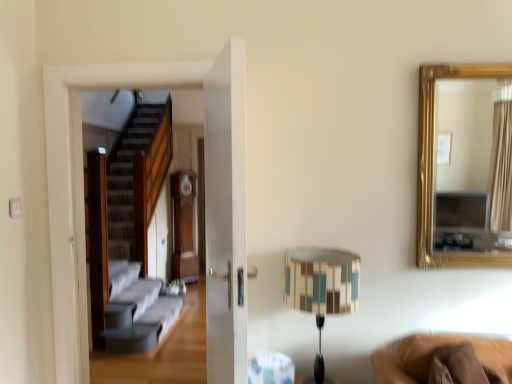
Question: From a real-world perspective, is multicolored fabric lampshade at center on gold-framed mirror at upper right?

Choices:
 (A) no
 (B) yes

Answer: (A)

Question: Is multicolored fabric lampshade at center to the right of gold-framed mirror at upper right from the viewer's perspective?

Choices:
 (A) no
 (B) yes

Answer: (A)

Question: Is multicolored fabric lampshade at center not near gold-framed mirror at upper right?

Choices:
 (A) yes
 (B) no

Answer: (A)

Question: Is the depth of multicolored fabric lampshade at center less than that of gold-framed mirror at upper right?

Choices:
 (A) no
 (B) yes

Answer: (B)

Question: Can you confirm if multicolored fabric lampshade at center is shorter than gold-framed mirror at upper right?

Choices:
 (A) yes
 (B) no

Answer: (A)

Question: Is multicolored fabric lampshade at center bigger than gold-framed mirror at upper right?

Choices:
 (A) yes
 (B) no

Answer: (A)

Question: Can you confirm if gold-framed mirror at upper right is positioned to the left of multicolored fabric lampshade at center?

Choices:
 (A) yes
 (B) no

Answer: (B)

Question: From the image's perspective, is gold-framed mirror at upper right on multicolored fabric lampshade at center?

Choices:
 (A) yes
 (B) no

Answer: (A)

Question: Is gold-framed mirror at upper right behind multicolored fabric lampshade at center?

Choices:
 (A) no
 (B) yes

Answer: (B)

Question: Is gold-framed mirror at upper right oriented away from multicolored fabric lampshade at center?

Choices:
 (A) yes
 (B) no

Answer: (B)

Question: Can you confirm if gold-framed mirror at upper right is thinner than multicolored fabric lampshade at center?

Choices:
 (A) no
 (B) yes

Answer: (B)

Question: Is gold-framed mirror at upper right in front of multicolored fabric lampshade at center?

Choices:
 (A) no
 (B) yes

Answer: (A)

Question: Considering the positions of gold-framed mirror at upper right and multicolored fabric lampshade at center in the image, is gold-framed mirror at upper right taller or shorter than multicolored fabric lampshade at center?

Choices:
 (A) short
 (B) tall

Answer: (B)